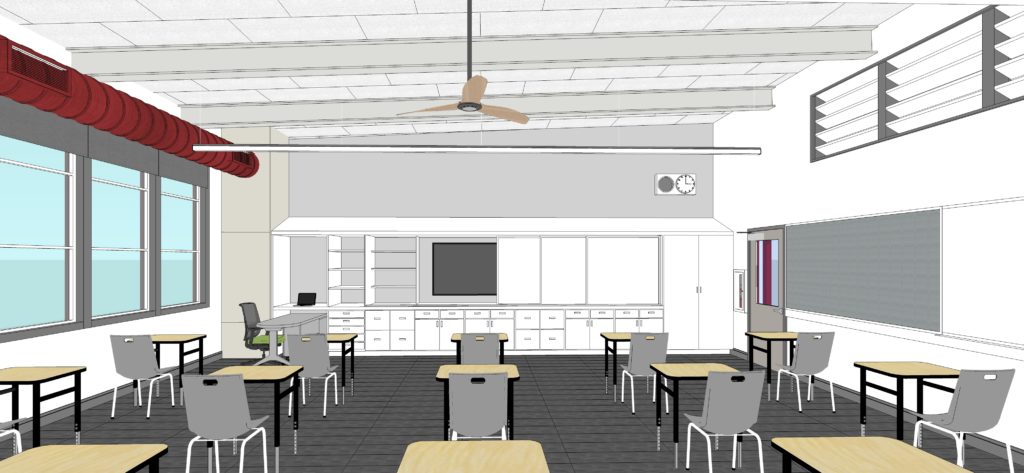
Find the location of a particular element. draws and cabinets is located at coordinates (390, 327), (534, 325), (546, 335), (566, 320), (417, 336), (440, 325), (577, 340), (599, 322), (626, 320).